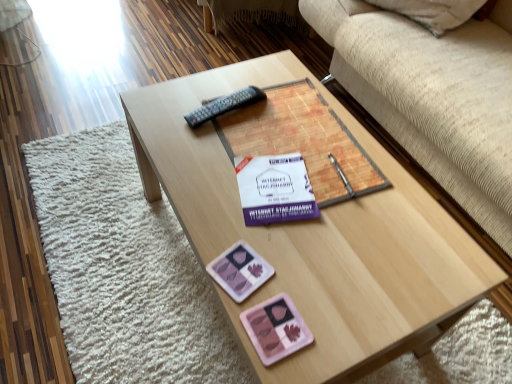
Locate an element on the screen. Image resolution: width=512 pixels, height=384 pixels. space that is in front of black plastic remote at center is located at coordinates (215, 152).